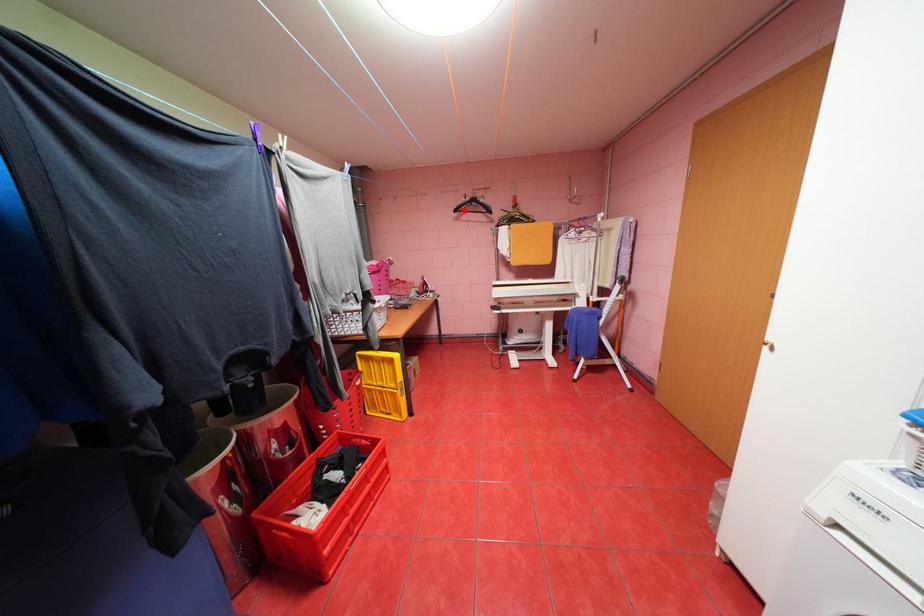
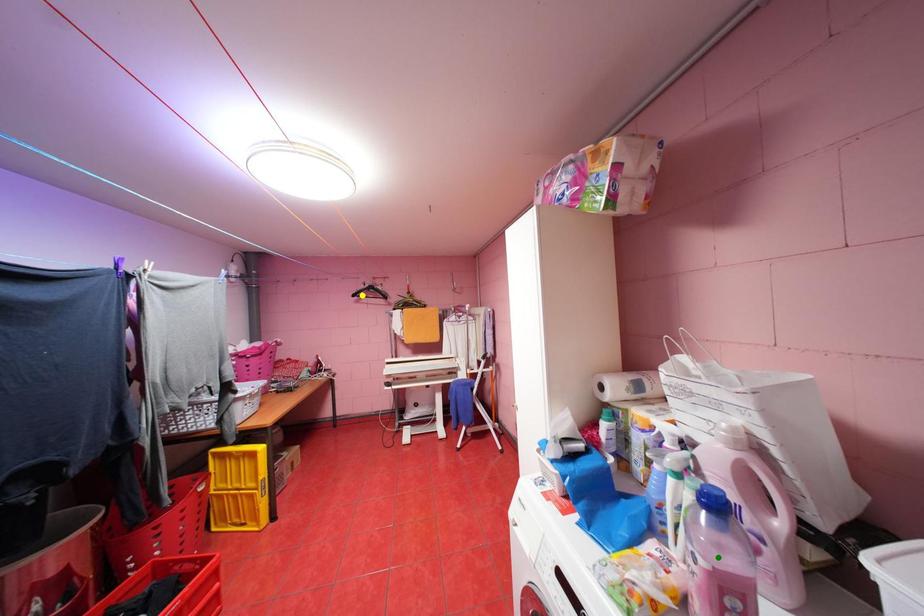
Question: I am providing you with two images of the same scene from different viewpoints. A red point is marked on the first image. You are given multiple points on the second image. Which spot in image 2 lines up with the point in image 1?

Choices:
 (A) blue point
 (B) green point
 (C) yellow point

Answer: (C)